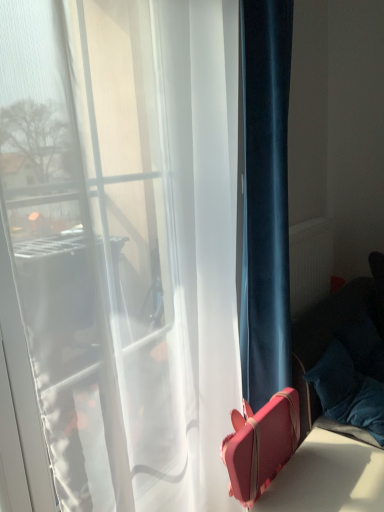
In order to face velvet blue curtain at right, should I rotate leftwards or rightwards?

Rotate right and turn 12.137 degrees.

Find the location of a particular element. This screenshot has height=512, width=384. matte white radiator at right is located at coordinates (309, 263).

The width and height of the screenshot is (384, 512). Identify the location of velvety blue pillow at lower right. (348, 392).

Considering the sizes of velvety blue pillow at lower right and matte white radiator at right in the image, is velvety blue pillow at lower right bigger or smaller than matte white radiator at right?

In the image, velvety blue pillow at lower right appears to be larger than matte white radiator at right.

Does velvety blue pillow at lower right have a lesser height compared to matte white radiator at right?

Yes.

Which of these two, velvety blue pillow at lower right or matte white radiator at right, is thinner?

matte white radiator at right.

Is the depth of velvety blue pillow at lower right less than that of matte white radiator at right?

Yes, velvety blue pillow at lower right is closer to the camera.

Locate an element on the screen. This screenshot has width=384, height=512. curtain above the pink leather suitcase at lower right (from the image's perspective) is located at coordinates (265, 198).

Is velvet blue curtain at right looking in the opposite direction of pink leather suitcase at lower right?

No, velvet blue curtain at right is not facing away from pink leather suitcase at lower right.

Is point (258, 64) positioned after point (316, 466)?

Yes, point (258, 64) is behind point (316, 466).

Which object is wider, velvet blue curtain at right or pink leather suitcase at lower right?

pink leather suitcase at lower right.

Is velvet blue curtain at right not close to matte white radiator at right?

velvet blue curtain at right is near matte white radiator at right, not far away.

How many degrees apart are the facing directions of velvet blue curtain at right and matte white radiator at right?

The facing directions of velvet blue curtain at right and matte white radiator at right are 0.221 degrees apart.

From the image's perspective, is velvet blue curtain at right beneath matte white radiator at right?

No.

Which of these two, velvety blue pillow at lower right or velvet blue curtain at right, is smaller?

With smaller size is velvety blue pillow at lower right.

Is velvety blue pillow at lower right oriented towards velvet blue curtain at right?

No.

Are velvety blue pillow at lower right and velvet blue curtain at right far apart?

No, velvety blue pillow at lower right is not far from velvet blue curtain at right.

Does velvety blue pillow at lower right have a lesser height compared to velvet blue curtain at right?

Correct, velvety blue pillow at lower right is not as tall as velvet blue curtain at right.

At what (x,y) coordinates should I click in order to perform the action: click on curtain that is above the matte white radiator at right (from a real-world perspective). Please return your answer as a coordinate pair (x, y). This screenshot has height=512, width=384. Looking at the image, I should click on (265, 198).

Is velvet blue curtain at right completely or partially inside matte white radiator at right?

No.

Who is taller, matte white radiator at right or velvet blue curtain at right?

velvet blue curtain at right is taller.

Is matte white radiator at right not close to velvet blue curtain at right?

Actually, matte white radiator at right and velvet blue curtain at right are a little close together.

Is velvety blue pillow at lower right located within pink leather suitcase at lower right?

That's incorrect, velvety blue pillow at lower right is not inside pink leather suitcase at lower right.

In terms of size, does pink leather suitcase at lower right appear bigger or smaller than velvety blue pillow at lower right?

pink leather suitcase at lower right is bigger than velvety blue pillow at lower right.

Would you say pink leather suitcase at lower right is to the left or to the right of velvety blue pillow at lower right in the picture?

Based on their positions, pink leather suitcase at lower right is located to the left of velvety blue pillow at lower right.

Does point (365, 448) appear closer or farther from the camera than point (353, 404)?

Clearly, point (365, 448) is closer to the camera than point (353, 404).

From the image's perspective, is velvety blue pillow at lower right beneath pink leather suitcase at lower right?

No, from the image's perspective, velvety blue pillow at lower right is not beneath pink leather suitcase at lower right.

Does velvety blue pillow at lower right have a greater height compared to pink leather suitcase at lower right?

Incorrect, the height of velvety blue pillow at lower right is not larger of that of pink leather suitcase at lower right.

Is velvety blue pillow at lower right directly adjacent to pink leather suitcase at lower right?

No, velvety blue pillow at lower right is not making contact with pink leather suitcase at lower right.

Is velvety blue pillow at lower right positioned before pink leather suitcase at lower right?

No, velvety blue pillow at lower right is further to the viewer.

Locate an element on the screen. pillow located in front of the matte white radiator at right is located at coordinates (348, 392).

At what (x,y) coordinates should I click in order to perform the action: click on curtain on the left of pink leather suitcase at lower right. Please return your answer as a coordinate pair (x, y). This screenshot has height=512, width=384. Looking at the image, I should click on (265, 198).

Which object lies further to the anchor point pink leather suitcase at lower right, matte white radiator at right or velvet blue curtain at right?

matte white radiator at right lies further to pink leather suitcase at lower right than the other object.

Looking at the image, which one is located closer to velvety blue pillow at lower right, velvet blue curtain at right or matte white radiator at right?

velvet blue curtain at right lies closer to velvety blue pillow at lower right than the other object.

Looking at the image, which one is located closer to pink leather suitcase at lower right, velvet blue curtain at right or velvety blue pillow at lower right?

velvety blue pillow at lower right is positioned closer to the anchor pink leather suitcase at lower right.

From the image, which object appears to be nearer to matte white radiator at right, velvet blue curtain at right or velvety blue pillow at lower right?

velvety blue pillow at lower right is positioned closer to the anchor matte white radiator at right.

Looking at the image, which one is located further to velvet blue curtain at right, velvety blue pillow at lower right or matte white radiator at right?

Based on the image, matte white radiator at right appears to be further to velvet blue curtain at right.

From the image, which object appears to be farther from matte white radiator at right, pink leather suitcase at lower right or velvety blue pillow at lower right?

pink leather suitcase at lower right is positioned further to the anchor matte white radiator at right.

Estimate the real-world distances between objects in this image. Which object is further from velvet blue curtain at right, velvety blue pillow at lower right or pink leather suitcase at lower right?

pink leather suitcase at lower right is positioned further to the anchor velvet blue curtain at right.

Which object lies further to the anchor point velvet blue curtain at right, matte white radiator at right or pink leather suitcase at lower right?

matte white radiator at right.

You are a GUI agent. You are given a task and a screenshot of the screen. Output one action in this format:
    pyautogui.click(x=<x>, y=<y>)
    Task: Click on the radiator that lies between velvet blue curtain at right and pink leather suitcase at lower right from top to bottom
    This screenshot has width=384, height=512.
    Given the screenshot: What is the action you would take?
    pyautogui.click(x=309, y=263)

This screenshot has height=512, width=384. In order to click on pillow positioned between velvet blue curtain at right and matte white radiator at right from near to far in this screenshot , I will do `click(348, 392)`.

Image resolution: width=384 pixels, height=512 pixels. I want to click on pillow that lies between velvet blue curtain at right and pink leather suitcase at lower right from top to bottom, so click(348, 392).

I want to click on pillow between pink leather suitcase at lower right and matte white radiator at right in the front-back direction, so click(348, 392).